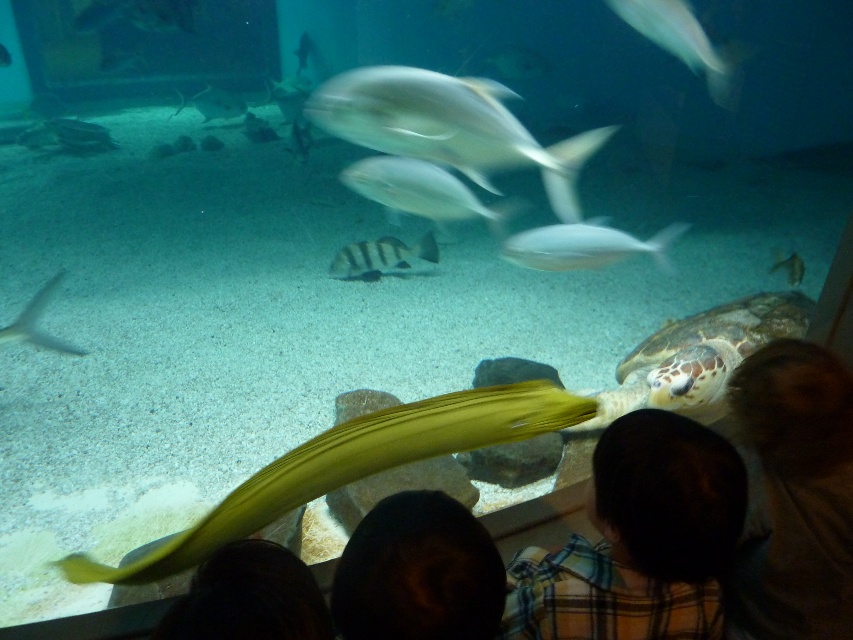
You are an underwater photographer aiming to capture a clear shot of the dark brown hair at lower center and the leathery brown turtle at lower right. Based on their positions, which subject should you focus on first to ensure both are in focus?

You should focus on the dark brown hair at lower center first because it is closer to the viewer than the leathery brown turtle at lower right, so adjusting focus from near to far will help both subjects be in focus.

You are an underwater photographer trying to capture both the dark brown hair at lower center and the leathery brown turtle at lower right in a single frame. Based on their positions, which object should you adjust your camera to focus on first to ensure both are in the shot?

The dark brown hair at lower center is to the left of the leathery brown turtle at lower right, so you should focus on the leathery brown turtle at lower right first to ensure both are captured in the frame.

From the picture: You are an underwater photographer aiming to capture a closeup shot of the yellow fish in the foreground. To avoid disturbing the turtle, you need to position your camera so that the yellow fish is centered in the frame while keeping the turtle out of the shot. Given the coordinates of the turtle at point (698, 356), can you determine if the turtle is positioned to the left or right of the yellow fish?

The turtle at point (698, 356) is located to the right of the yellow fish in the foreground.